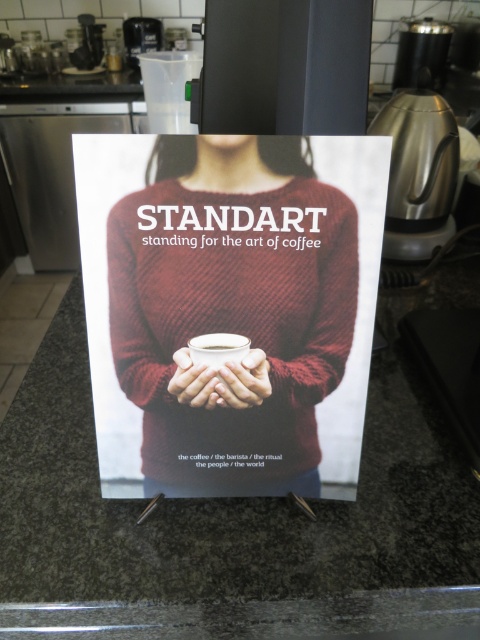
Can you confirm if matte brown cup at center is wider than white matte cup at center?

Yes, matte brown cup at center is wider than white matte cup at center.

Does matte brown cup at center have a smaller size compared to white matte cup at center?

No, matte brown cup at center is not smaller than white matte cup at center.

What do you see at coordinates (196, 381) in the screenshot?
I see `matte brown cup at center` at bounding box center [196, 381].

Locate an element on the screen. matte brown cup at center is located at coordinates (196, 381).

How much distance is there between matte red sweater at center and matte brown hands at center?

matte red sweater at center is 3.55 inches from matte brown hands at center.

Is point (84, 248) positioned behind point (240, 401)?

No.

Between point (168, 228) and point (227, 372), which one is positioned behind?

Point (227, 372)

Locate an element on the screen. matte red sweater at center is located at coordinates (228, 307).

Does matte brown hands at center appear over matte brown cup at center?

No, matte brown hands at center is not above matte brown cup at center.

Which is in front, point (231, 404) or point (188, 403)?

Point (231, 404) is more forward.

Does point (239, 403) lie in front of point (180, 372)?

No, (239, 403) is further to viewer.

Identify the location of matte brown hands at center. (240, 381).